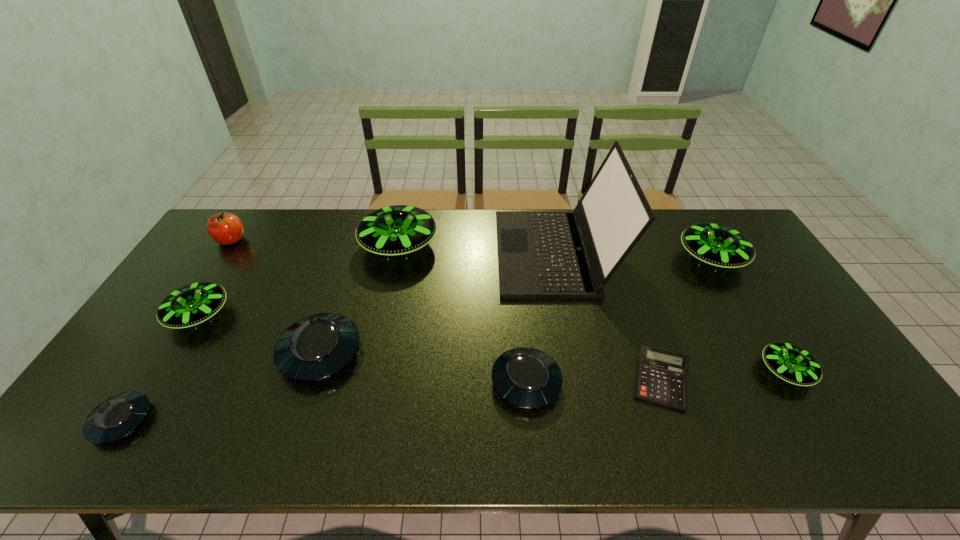
At what (x,y) coordinates should I click in order to perform the action: click on the third saucer from right to left. Please return your answer as a coordinate pair (x, y). This screenshot has height=540, width=960. Looking at the image, I should click on (526, 377).

The image size is (960, 540). Find the location of `the second biggest gray saucer`. the second biggest gray saucer is located at coordinates pos(526,377).

Identify the location of the shortest saucer. (115, 418).

This screenshot has width=960, height=540. In order to click on the smallest gray saucer in this screenshot , I will do `click(115, 418)`.

What are the coordinates of `the shortest object` in the screenshot? It's located at (661, 377).

Where is `vacant space located 0.290m on the surface of the laptop`? vacant space located 0.290m on the surface of the laptop is located at coordinates (412, 253).

Find the location of a particular element. This screenshot has width=960, height=540. vacant space located on the surface of the laptop is located at coordinates (430, 253).

You are a GUI agent. You are given a task and a screenshot of the screen. Output one action in this format:
    pyautogui.click(x=<x>, y=<y>)
    Task: Click on the vacant space situated on the surface of the laptop
    The image size is (960, 540).
    Given the screenshot: What is the action you would take?
    pyautogui.click(x=480, y=253)

I want to click on free space located on the front of the ninth shortest object, so click(391, 282).

Locate an element on the screen. Image resolution: width=960 pixels, height=540 pixels. vacant space located 0.140m on the back of the second biggest green saucer is located at coordinates (685, 214).